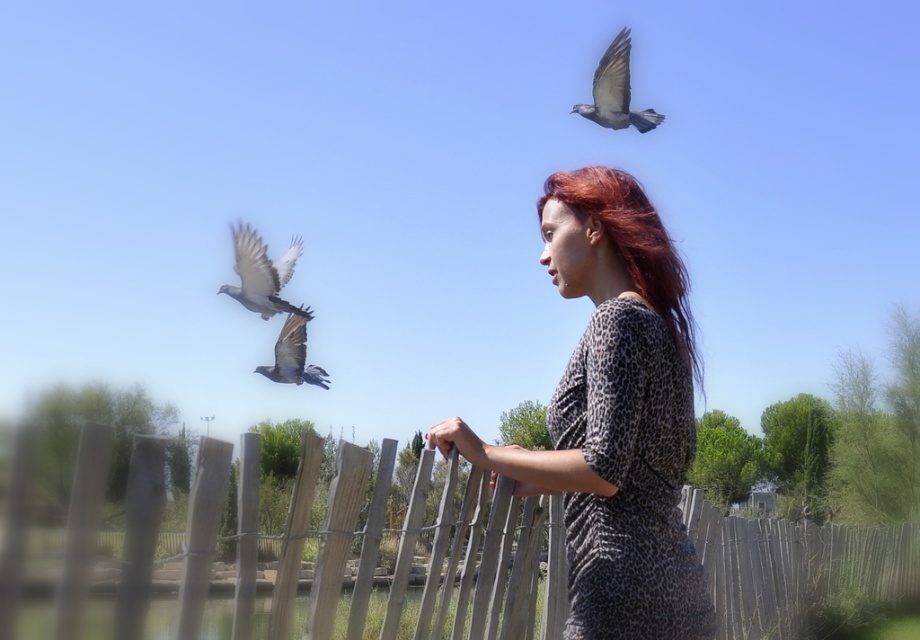
Question: Is leopard print dress at center bigger than wooden fence at center?

Choices:
 (A) yes
 (B) no

Answer: (B)

Question: Estimate the real-world distances between objects in this image. Which object is closer to the leopard print dress at center?

Choices:
 (A) gray feathered bird at upper left
 (B) shiny red hair at center

Answer: (B)

Question: Is gray feathered bird at upper left positioned at the back of gray feathered bird at center?

Choices:
 (A) yes
 (B) no

Answer: (B)

Question: Which object is closer to the camera taking this photo?

Choices:
 (A) gray feathered bird at center
 (B) gray feathered bird at upper left

Answer: (B)

Question: Which object is closer to the camera taking this photo?

Choices:
 (A) leopard print dress at center
 (B) gray feathered bird at center
 (C) gray feathered bird at upper left

Answer: (A)

Question: Can you confirm if wooden fence at center is wider than gray feathered bird at center?

Choices:
 (A) no
 (B) yes

Answer: (B)